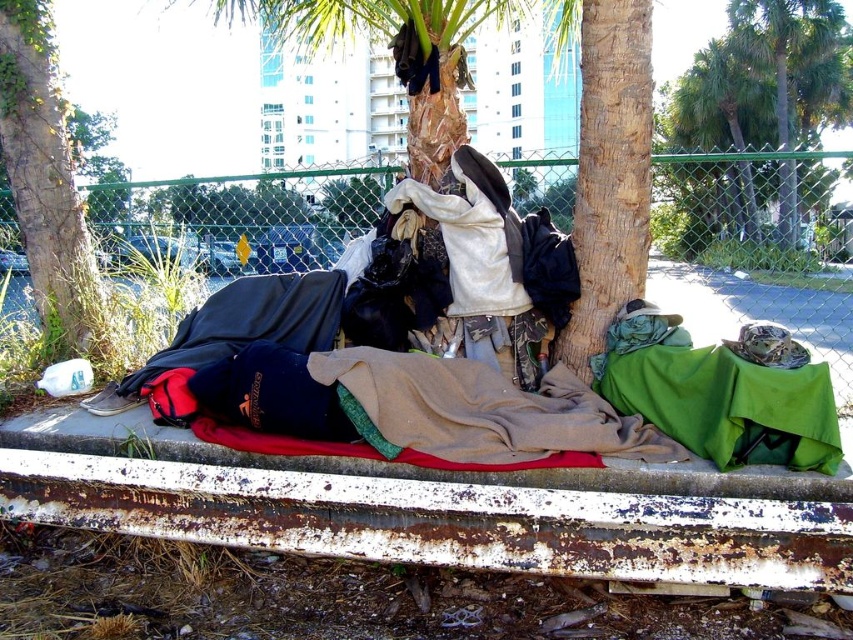
From the picture: Which of these two, green leafy palm tree at center or bark textured tree at center, stands shorter?

bark textured tree at center

Does green leafy palm tree at center have a larger size compared to bark textured tree at center?

Correct, green leafy palm tree at center is larger in size than bark textured tree at center.

Locate an element on the screen. green leafy palm tree at center is located at coordinates (761, 116).

Between camouflage fabric pants at center and green leafy palm tree at center, which one is positioned lower?

Positioned lower is camouflage fabric pants at center.

Is camouflage fabric pants at center smaller than green leafy palm tree at center?

Yes, camouflage fabric pants at center is smaller than green leafy palm tree at center.

Is point (451, 324) less distant than point (682, 118)?

That is True.

Image resolution: width=853 pixels, height=640 pixels. Identify the location of camouflage fabric pants at center. (462, 273).

Is camouflage fabric pants at center below green rough bark tree at lower left?

Yes.

Who is higher up, camouflage fabric pants at center or green rough bark tree at lower left?

Positioned higher is green rough bark tree at lower left.

Where is `camouflage fabric pants at center`? The height and width of the screenshot is (640, 853). camouflage fabric pants at center is located at coordinates (462, 273).

This screenshot has width=853, height=640. Identify the location of camouflage fabric pants at center. (462, 273).